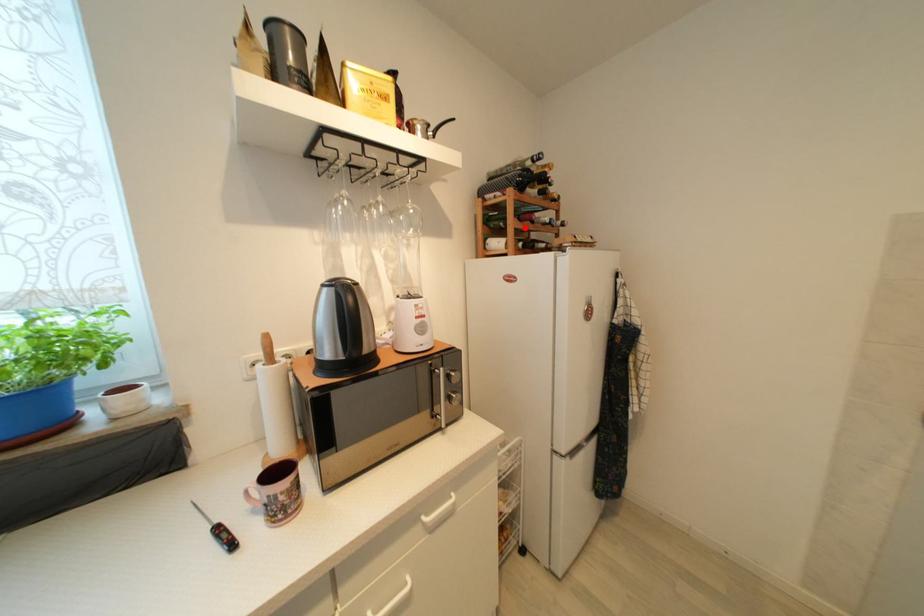
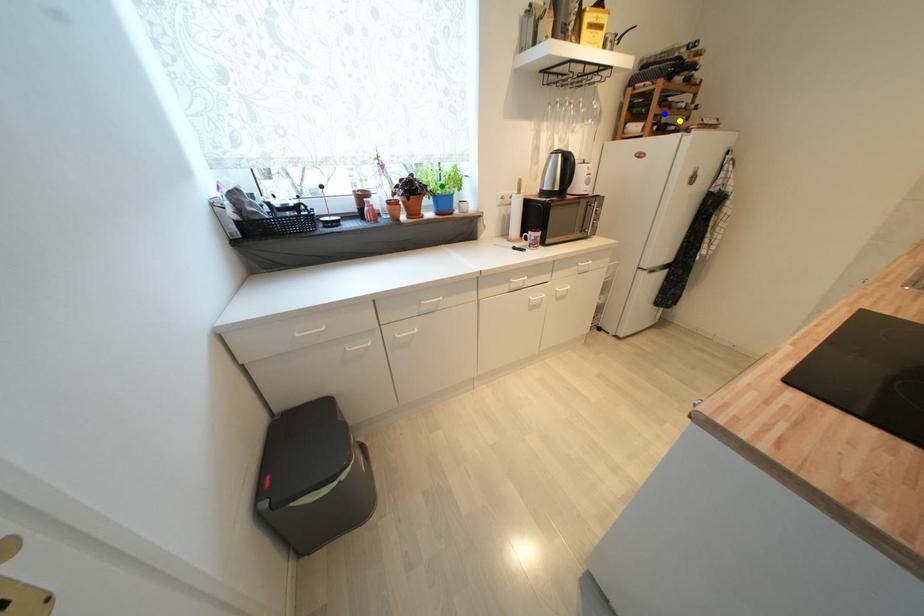
Question: I am providing you with two images of the same scene from different viewpoints. A red point is marked on the first image. You are given multiple points on the second image. Which mark in image 2 goes with the point in image 1?

Choices:
 (A) green point
 (B) blue point
 (C) yellow point

Answer: (B)